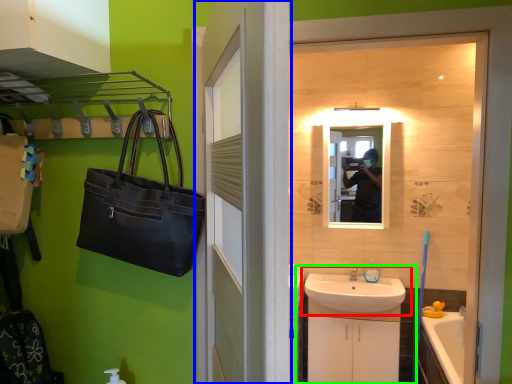
Question: Considering the real-world distances, which object is farthest from sink (highlighted by a red box)? door (highlighted by a blue box) or bathroom cabinet (highlighted by a green box)?

Choices:
 (A) door
 (B) bathroom cabinet

Answer: (A)